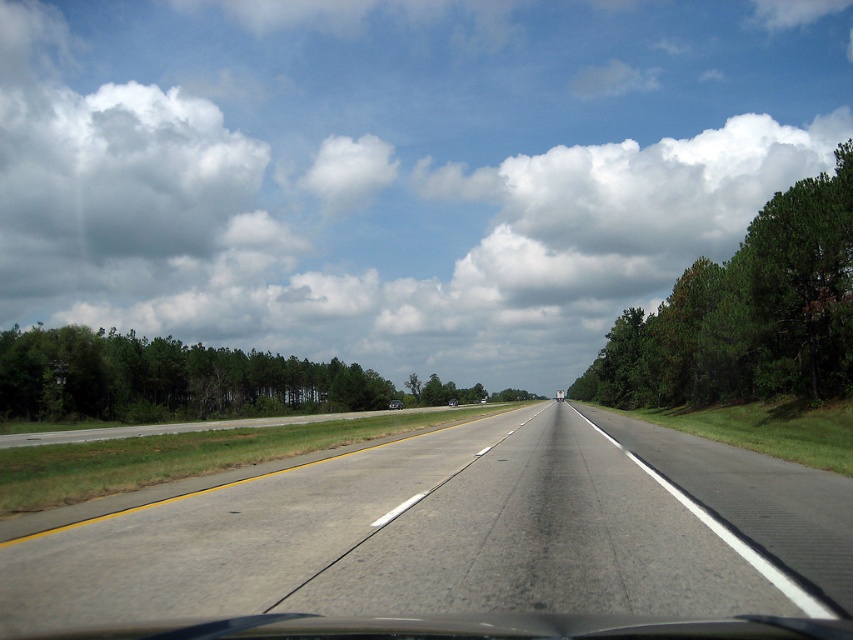
Is point (575, 554) in front of point (450, 401)?

That is True.

This screenshot has width=853, height=640. I want to click on gray asphalt highway at center, so click(x=456, y=532).

Does white fluffy cloud at upper center appear over matte black truck at center?

Yes, white fluffy cloud at upper center is above matte black truck at center.

Find the location of a particular element. This screenshot has height=640, width=853. white fluffy cloud at upper center is located at coordinates (397, 168).

Is green leafy tree at right in front of black glossy sedan at center?

Yes, green leafy tree at right is closer to the viewer.

The width and height of the screenshot is (853, 640). In order to click on green leafy tree at right in this screenshot , I will do `click(746, 314)`.